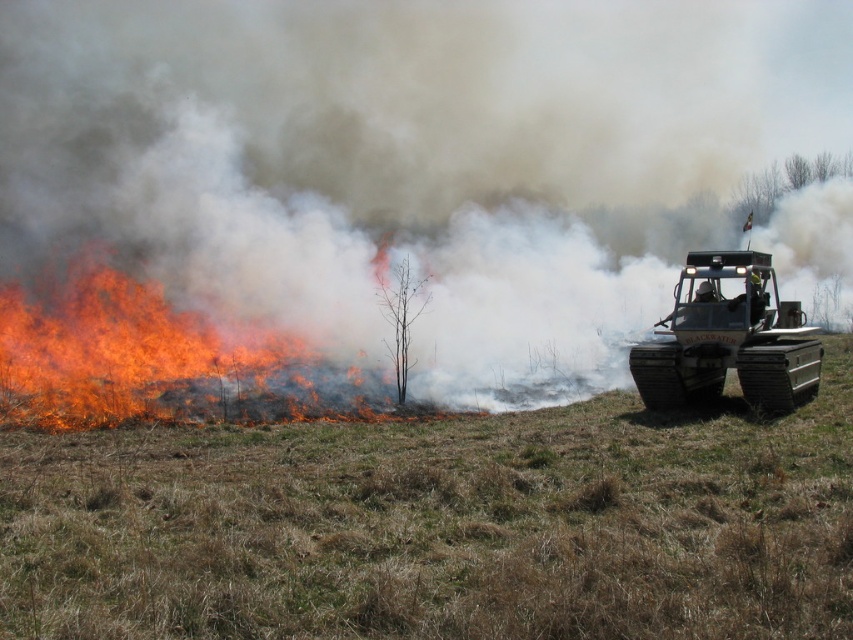
Question: Is white smoke at center wider than flame-yellows grass fire at left?

Choices:
 (A) no
 (B) yes

Answer: (B)

Question: Observing the image, what is the correct spatial positioning of flame-yellows grass fire at left in reference to matte black tracked vehicle at right?

Choices:
 (A) below
 (B) above

Answer: (A)

Question: Based on their relative distances, which object is nearer to the brown dry grass at lower center?

Choices:
 (A) white smoke at center
 (B) flame-yellows grass fire at left
 (C) matte black tracked vehicle at right

Answer: (C)

Question: Which point is closer to the camera taking this photo?

Choices:
 (A) (701, 253)
 (B) (119, 301)

Answer: (A)

Question: Is white smoke at center positioned behind brown dry grass at lower center?

Choices:
 (A) no
 (B) yes

Answer: (B)

Question: Which object appears farthest from the camera in this image?

Choices:
 (A) matte black tracked vehicle at right
 (B) white smoke at center

Answer: (B)